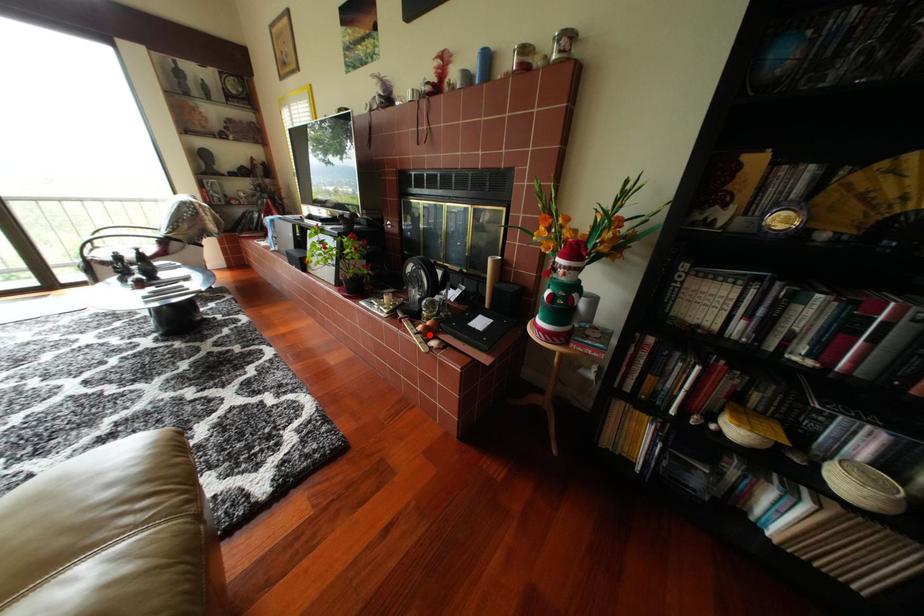
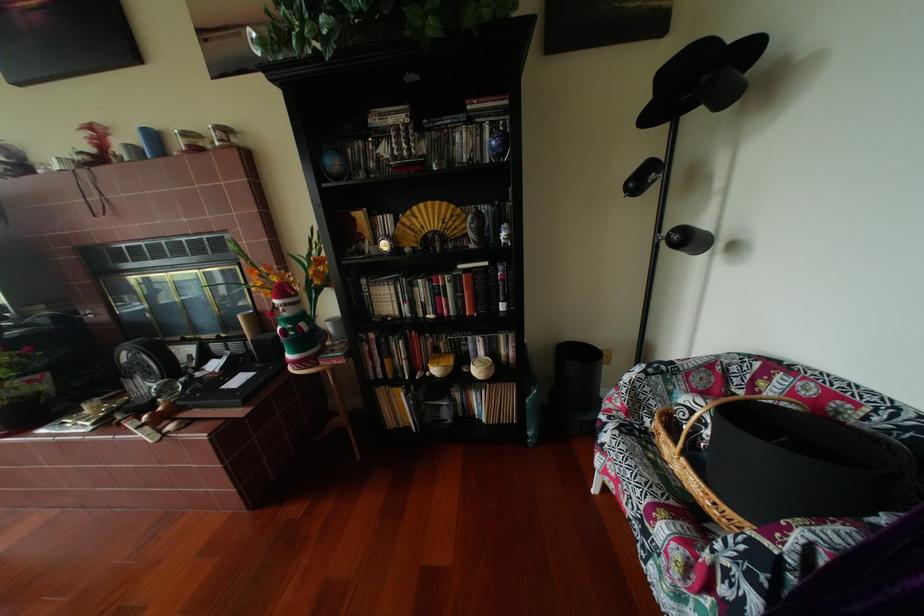
Find the pixel in the second image that matches the highlighted location in the first image.

(152, 429)